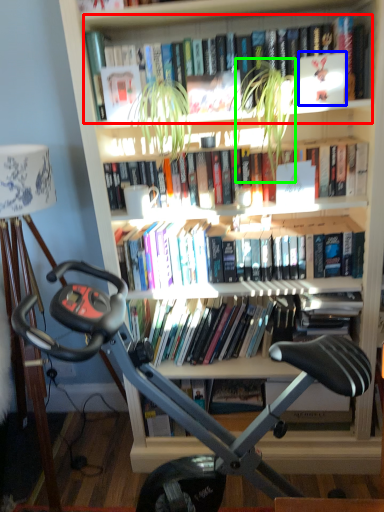
Question: Which object is the farthest from book (highlighted by a red box)? Choose among these: paperback book (highlighted by a blue box) or plant (highlighted by a green box).

Choices:
 (A) paperback book
 (B) plant

Answer: (A)